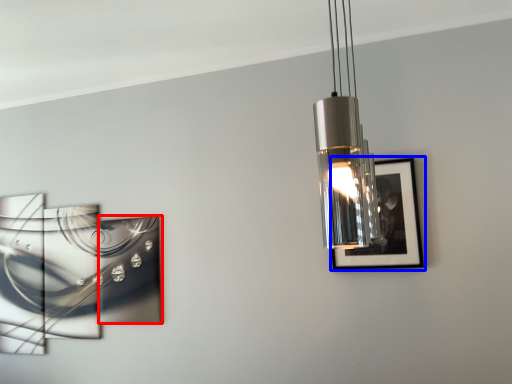
Question: Which object appears closest to the camera in this image, picture frame (highlighted by a red box) or picture frame (highlighted by a blue box)?

Choices:
 (A) picture frame
 (B) picture frame

Answer: (B)